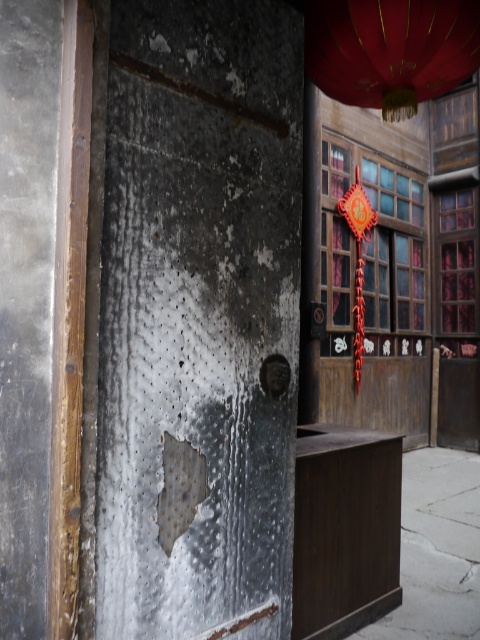
Question: Among these points, which one is farthest from the camera?

Choices:
 (A) (457, 81)
 (B) (189, 458)

Answer: (A)

Question: Can you confirm if rusty metal door at center is positioned below shiny red paper lantern at upper center?

Choices:
 (A) no
 (B) yes

Answer: (B)

Question: Which object appears farthest from the camera in this image?

Choices:
 (A) rusty metal door at center
 (B) shiny red paper lantern at upper center

Answer: (B)

Question: Does rusty metal door at center have a greater width compared to shiny red paper lantern at upper center?

Choices:
 (A) no
 (B) yes

Answer: (A)

Question: Is rusty metal door at center wider than shiny red paper lantern at upper center?

Choices:
 (A) no
 (B) yes

Answer: (A)

Question: Which point is farther to the camera?

Choices:
 (A) (441, 80)
 (B) (232, 388)

Answer: (A)